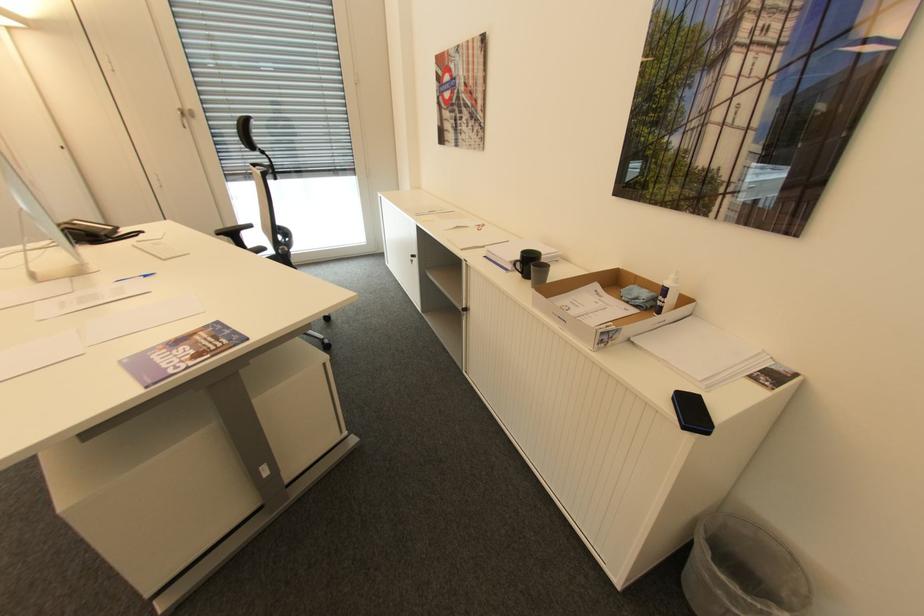
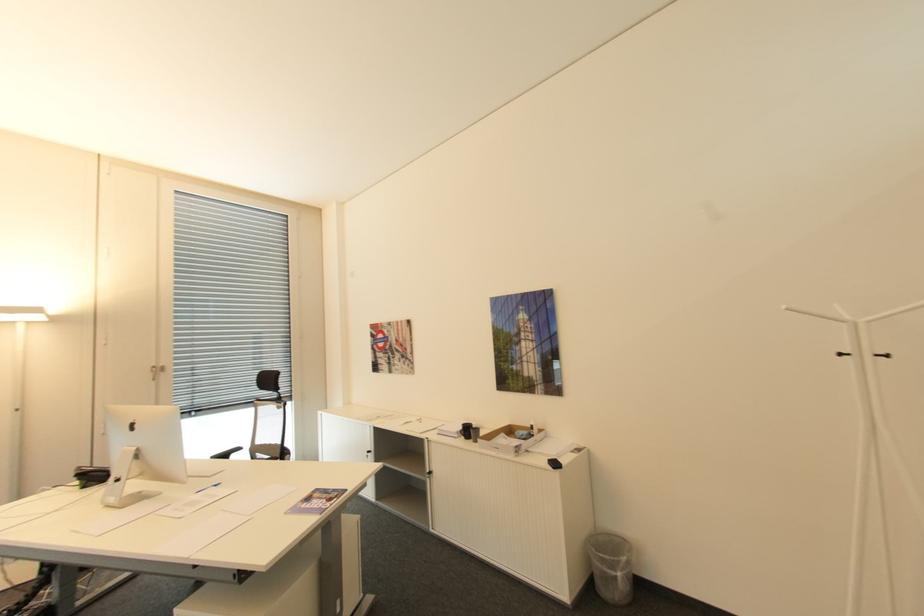
Find the pixel in the second image that matches [529,252] in the first image.

(468, 424)